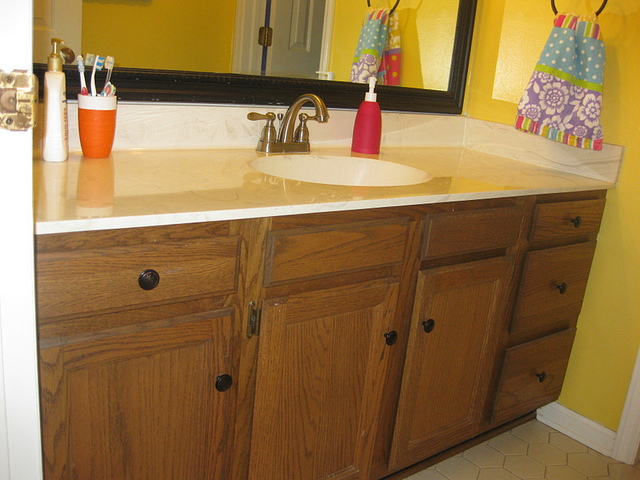
Identify the location of bottle. The width and height of the screenshot is (640, 480). (x=367, y=118).